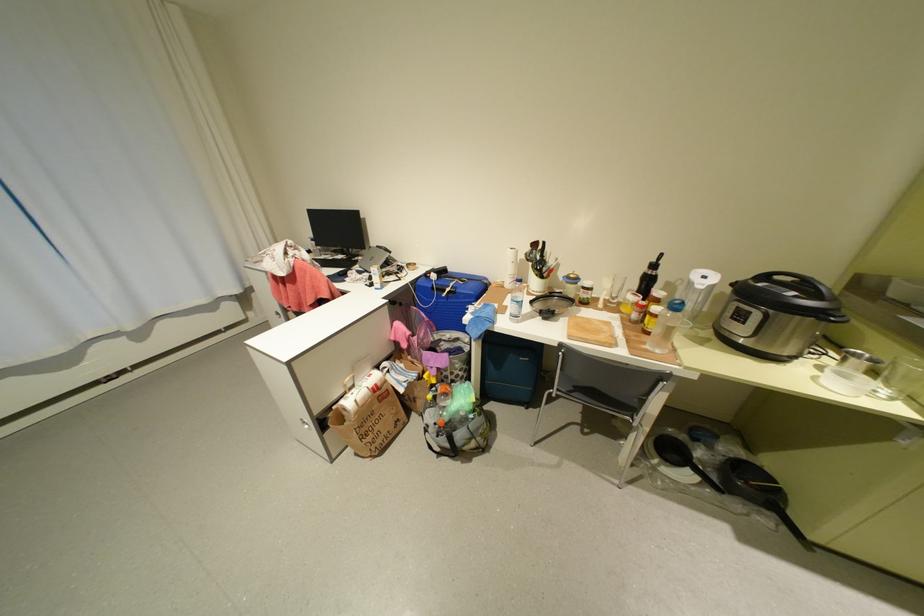
The height and width of the screenshot is (616, 924). Describe the element at coordinates (785, 280) in the screenshot. I see `the pan lid handle` at that location.